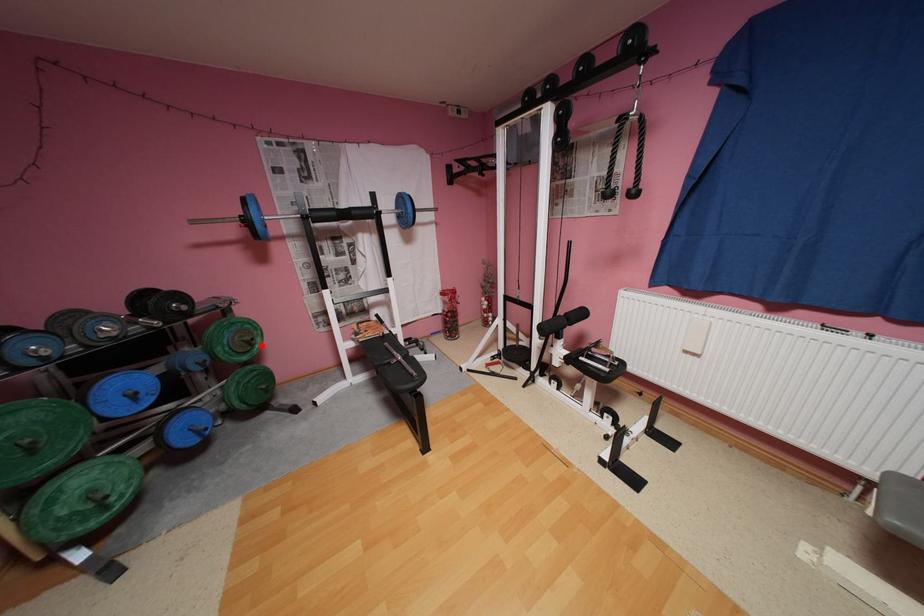
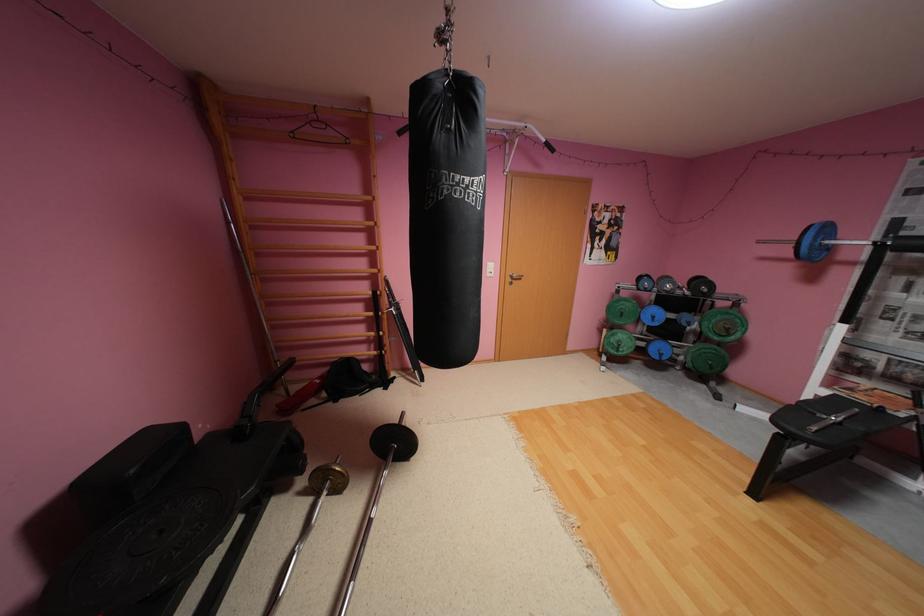
Question: I am providing you with two images of the same scene from different viewpoints. In image1, a red point is highlighted. Considering the same 3D point in image2, which of the following is correct?

Choices:
 (A) It is closer
 (B) It is farther

Answer: (B)